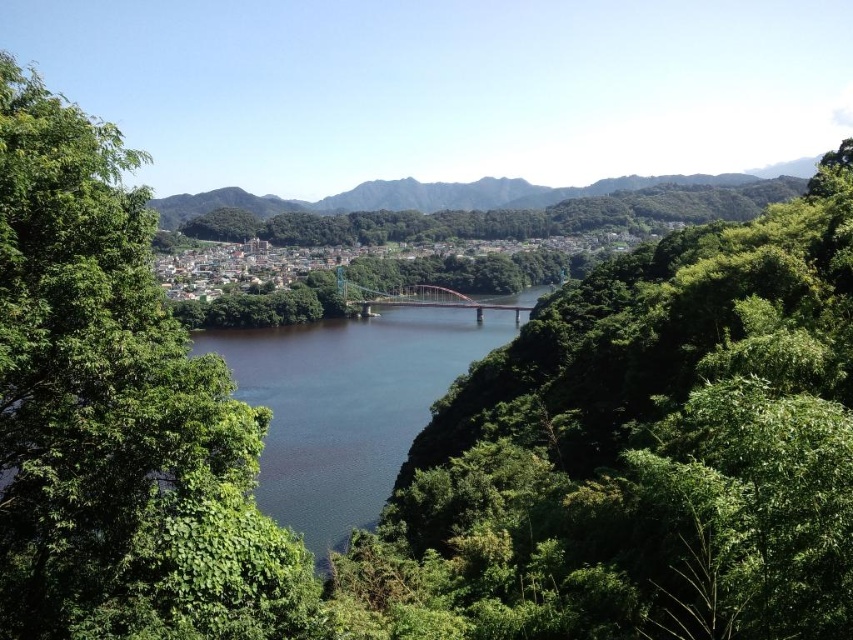
Question: Among these points, which one is nearest to the camera?

Choices:
 (A) (372, 298)
 (B) (90, 188)
 (C) (287, 456)
 (D) (548, 403)

Answer: (B)

Question: Is dark green water at center above metallic bridge at center?

Choices:
 (A) yes
 (B) no

Answer: (B)

Question: Among these objects, which one is farthest from the camera?

Choices:
 (A) dark green water at center
 (B) metallic bridge at center

Answer: (B)

Question: Is green leafy tree at left wider than metallic bridge at center?

Choices:
 (A) no
 (B) yes

Answer: (A)

Question: Is green leafy tree at center positioned in front of green leafy tree at left?

Choices:
 (A) yes
 (B) no

Answer: (B)

Question: Which of the following is the closest to the observer?

Choices:
 (A) (311, 372)
 (B) (363, 285)

Answer: (A)